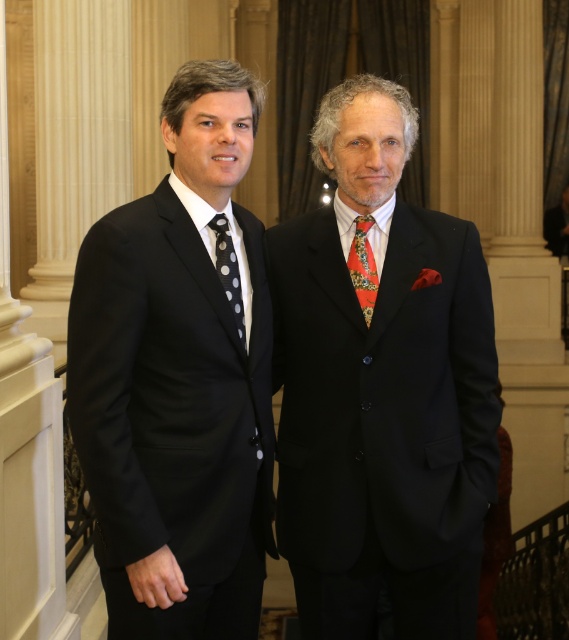
Question: Which point is farther to the camera?

Choices:
 (A) matte black suit at center
 (B) black satin suit at left
 (C) multicolored patterned tie at center

Answer: (A)

Question: Among these points, which one is nearest to the camera?

Choices:
 (A) (222, 250)
 (B) (180, 394)

Answer: (B)

Question: In this image, where is black satin suit at left located relative to black dotted fabric tie at left?

Choices:
 (A) left
 (B) right

Answer: (A)

Question: Is multicolored patterned tie at center positioned in front of black dotted fabric tie at left?

Choices:
 (A) yes
 (B) no

Answer: (B)

Question: Which point is closer to the camera?

Choices:
 (A) multicolored patterned tie at center
 (B) black satin suit at left

Answer: (B)

Question: Observing the image, what is the correct spatial positioning of black satin suit at left in reference to black dotted fabric tie at left?

Choices:
 (A) right
 (B) left

Answer: (B)